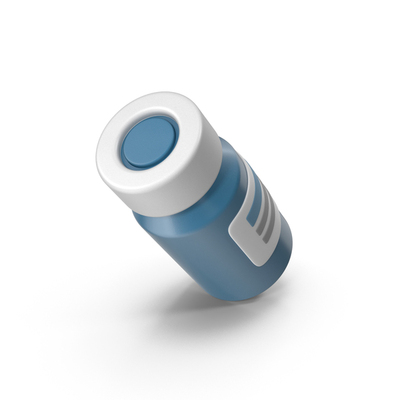
Image resolution: width=400 pixels, height=400 pixels. Identify the location of medicine bottle. (222, 258).